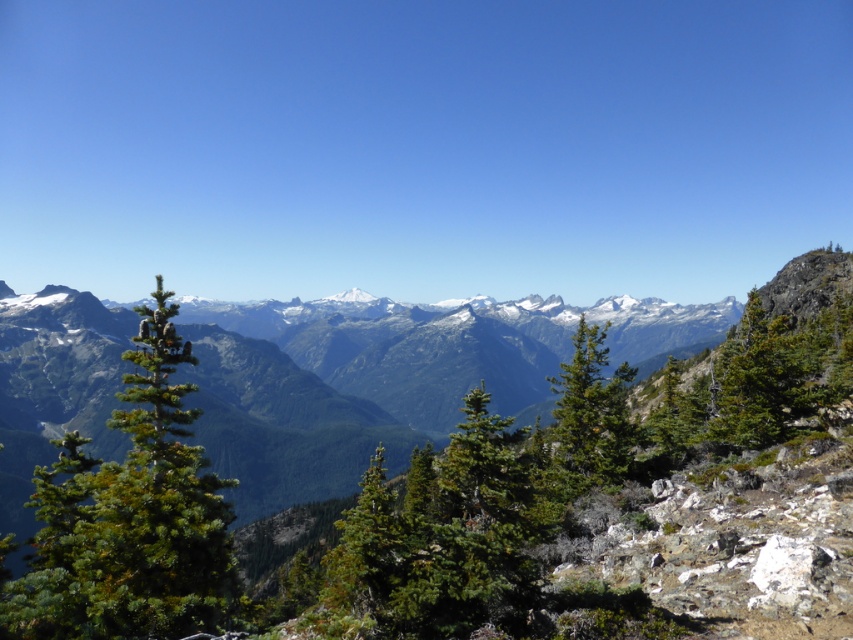
Question: Can you confirm if green textured pine trees at center is thinner than green textured pine tree at center?

Choices:
 (A) yes
 (B) no

Answer: (B)

Question: Considering the relative positions of green textured pine trees at center and green needle-like at left in the image provided, where is green textured pine trees at center located with respect to green needle-like at left?

Choices:
 (A) right
 (B) left

Answer: (A)

Question: Among these objects, which one is nearest to the camera?

Choices:
 (A) green textured pine trees at center
 (B) green needle-like at left

Answer: (B)

Question: Which is nearer to the green textured pine tree at center?

Choices:
 (A) green textured pine trees at center
 (B) green needle-like at left

Answer: (B)

Question: Is green textured pine trees at center bigger than green needle-like at left?

Choices:
 (A) yes
 (B) no

Answer: (A)

Question: Which point is closer to the camera?

Choices:
 (A) (584, 362)
 (B) (131, 376)
 (C) (242, 420)

Answer: (B)